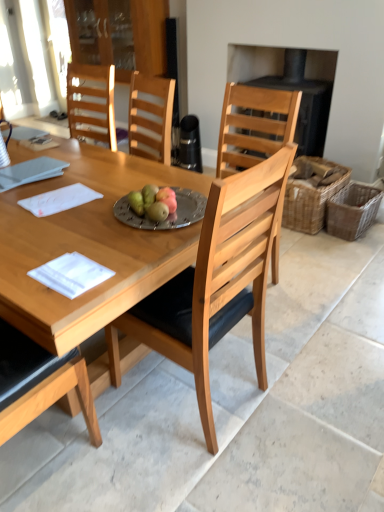
You are a GUI agent. You are given a task and a screenshot of the screen. Output one action in this format:
    pyautogui.click(x=<x>, y=<y>)
    Task: Click on the vacant position to the left of silver metallic plate at center
    Image resolution: width=384 pixels, height=512 pixels.
    Given the screenshot: What is the action you would take?
    pyautogui.click(x=93, y=214)